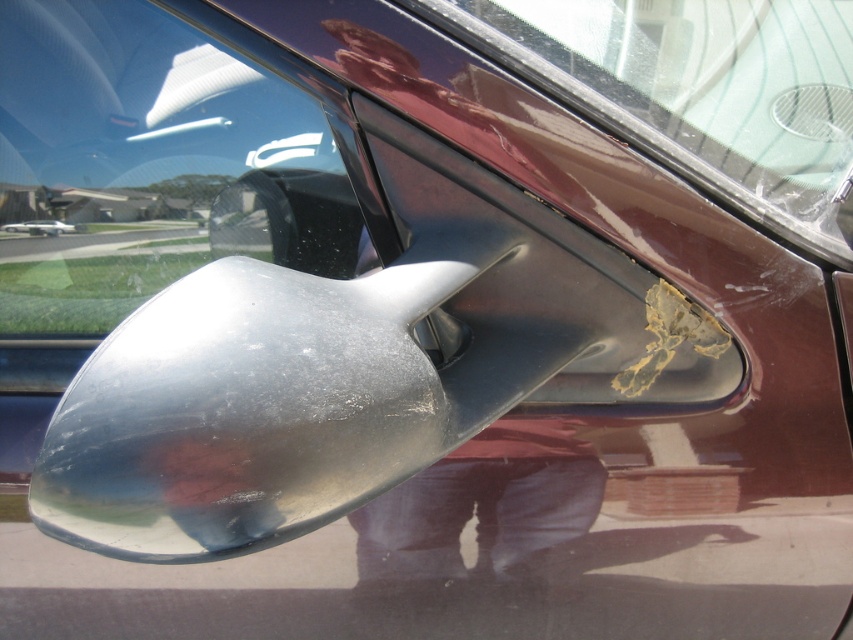
Is transparent glass car window at upper left positioned behind transparent plastic windshield at upper center?

Yes, it is.

Which is in front, point (245, 237) or point (850, 45)?

Point (245, 237) is more forward.

Where is `transparent glass car window at upper left`? transparent glass car window at upper left is located at coordinates (148, 163).